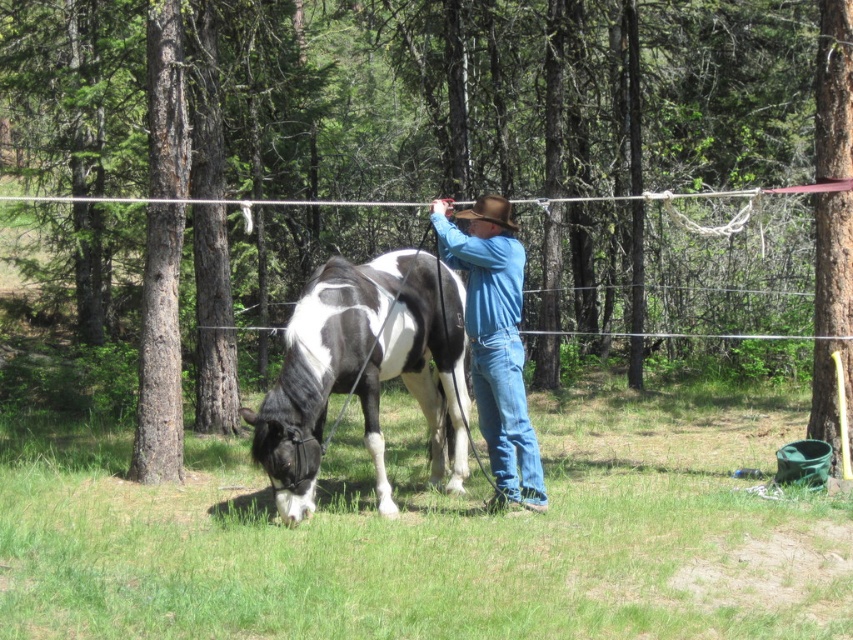
Between point (142, 332) and point (506, 212), which one is positioned in front?

Positioned in front is point (506, 212).

Does brown rough bark tree at left have a lesser width compared to brown felt cowboy hat at center?

In fact, brown rough bark tree at left might be wider than brown felt cowboy hat at center.

At what (x,y) coordinates should I click in order to perform the action: click on brown rough bark tree at left. Please return your answer as a coordinate pair (x, y). The image size is (853, 640). Looking at the image, I should click on (161, 253).

You are a GUI agent. You are given a task and a screenshot of the screen. Output one action in this format:
    pyautogui.click(x=<x>, y=<y>)
    Task: Click on the brown rough bark tree at left
    
    Given the screenshot: What is the action you would take?
    pyautogui.click(x=161, y=253)

Is black-and-white speckled horse at center to the left of blue denim jeans at center from the viewer's perspective?

Yes, black-and-white speckled horse at center is to the left of blue denim jeans at center.

Image resolution: width=853 pixels, height=640 pixels. I want to click on black-and-white speckled horse at center, so click(364, 371).

Who is shorter, green grass at lower center or brown rough bark tree at left?

With less height is green grass at lower center.

Can you confirm if green grass at lower center is wider than brown rough bark tree at left?

Indeed, green grass at lower center has a greater width compared to brown rough bark tree at left.

Which is behind, point (230, 451) or point (172, 38)?

The point (230, 451) is behind.

This screenshot has width=853, height=640. What are the coordinates of `green grass at lower center` in the screenshot? It's located at (438, 532).